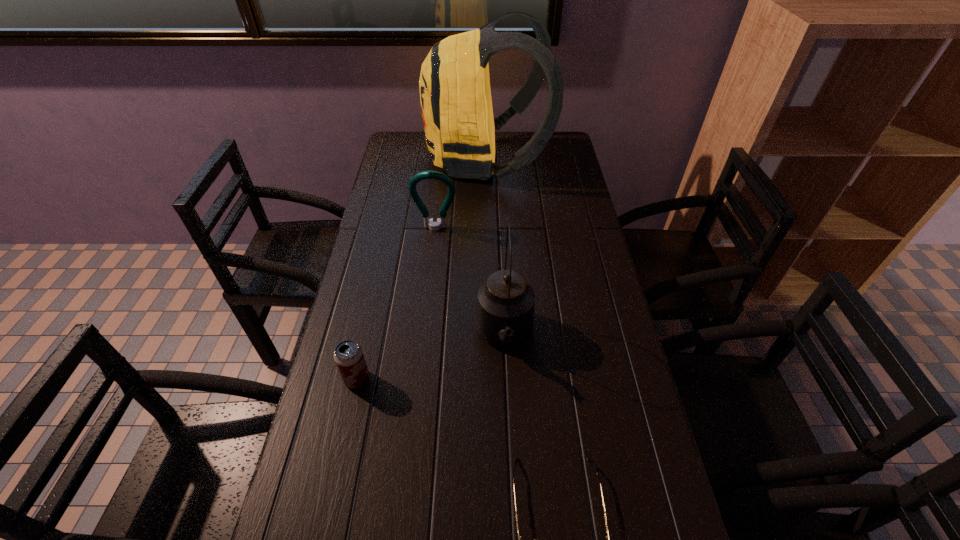
The height and width of the screenshot is (540, 960). I want to click on vacant space at the left edge of the desktop, so click(x=367, y=442).

You are a GUI agent. You are given a task and a screenshot of the screen. Output one action in this format:
    pyautogui.click(x=<x>, y=<y>)
    Task: Click on the blank space at the right edge of the desktop
    This screenshot has height=540, width=960.
    Given the screenshot: What is the action you would take?
    pyautogui.click(x=573, y=406)

This screenshot has width=960, height=540. Find the location of `free area in between the fourth shortest object and the second shortest object`. free area in between the fourth shortest object and the second shortest object is located at coordinates (431, 358).

You are a GUI agent. You are given a task and a screenshot of the screen. Output one action in this format:
    pyautogui.click(x=<x>, y=<y>)
    Task: Click on the vacant space in between the kettle and the backpack
    
    Given the screenshot: What is the action you would take?
    pyautogui.click(x=495, y=248)

This screenshot has width=960, height=540. I want to click on free spot between the leftmost object and the farthest object, so click(421, 270).

Find the location of a particular element. vacant point located between the farthest object and the fourth nearest object is located at coordinates pos(461,194).

The width and height of the screenshot is (960, 540). Find the location of `vacant point located between the farthest object and the third tallest object`. vacant point located between the farthest object and the third tallest object is located at coordinates (461, 194).

Choose which object is the fourth nearest neighbor to the leftmost object. Please provide its 2D coordinates. Your answer should be formatted as a tuple, i.e. [(x, y)], where the tuple contains the x and y coordinates of a point satisfying the conditions above.

[(455, 95)]

Select which object is the fourth closest to the shortest object. Please provide its 2D coordinates. Your answer should be formatted as a tuple, i.e. [(x, y)], where the tuple contains the x and y coordinates of a point satisfying the conditions above.

[(455, 95)]

Identify the location of free spot that satisfies the following two spatial constraints: 1. on the front-facing side of the backpack; 2. at the jaws of the third tallest object. (488, 228).